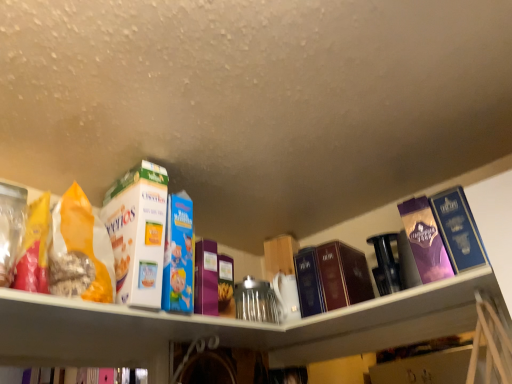
Question: From a real-world perspective, is purple glossy book at upper right, which appears as the seventh book when viewed from the left, physically below matte orange bag of cereal at left?

Choices:
 (A) no
 (B) yes

Answer: (B)

Question: Does purple glossy book at upper right, which appears as the second book when viewed from the right, turn towards matte orange bag of cereal at left?

Choices:
 (A) no
 (B) yes

Answer: (A)

Question: Does purple glossy book at upper right, which appears as the seventh book when viewed from the left, have a greater height compared to matte orange bag of cereal at left?

Choices:
 (A) yes
 (B) no

Answer: (B)

Question: Does purple glossy book at upper right, which appears as the second book when viewed from the right, have a larger size compared to matte orange bag of cereal at left?

Choices:
 (A) yes
 (B) no

Answer: (A)

Question: Is purple glossy book at upper right, which appears as the seventh book when viewed from the left, next to matte orange bag of cereal at left and touching it?

Choices:
 (A) yes
 (B) no

Answer: (B)

Question: Does purple glossy book at upper right, which appears as the second book when viewed from the right, have a smaller size compared to matte orange bag of cereal at left?

Choices:
 (A) yes
 (B) no

Answer: (B)

Question: Can you see matte orange bag of cereal at left touching white cardboard cereal box at upper left, the second book when ordered from left to right?

Choices:
 (A) yes
 (B) no

Answer: (A)

Question: Does matte orange bag of cereal at left contain white cardboard cereal box at upper left, the second book when ordered from left to right?

Choices:
 (A) no
 (B) yes

Answer: (A)

Question: Is matte orange bag of cereal at left at the right side of white cardboard cereal box at upper left, which is the 7th book in right-to-left order?

Choices:
 (A) yes
 (B) no

Answer: (B)

Question: Is matte orange bag of cereal at left at the left side of white cardboard cereal box at upper left, the second book when ordered from left to right?

Choices:
 (A) yes
 (B) no

Answer: (A)

Question: Is matte orange bag of cereal at left not near white cardboard cereal box at upper left, the second book when ordered from left to right?

Choices:
 (A) no
 (B) yes

Answer: (A)

Question: From a real-world perspective, is matte orange bag of cereal at left below white cardboard cereal box at upper left, the second book when ordered from left to right?

Choices:
 (A) no
 (B) yes

Answer: (B)

Question: From the image's perspective, is hardcover book at center, placed as the fourth book when sorted from right to left, beneath purple glossy book at upper right, the 8th book from the left?

Choices:
 (A) no
 (B) yes

Answer: (B)